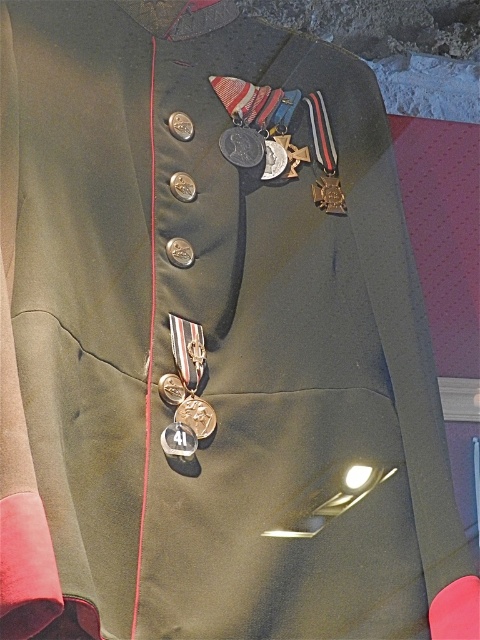
Question: In this image, where is gold metallic badge at center located relative to gold metallic cross at center?

Choices:
 (A) above
 (B) below

Answer: (B)

Question: From the image, what is the correct spatial relationship of gold metallic badge at center in relation to gold metallic cross at center?

Choices:
 (A) right
 (B) left

Answer: (B)

Question: Which object appears farthest from the camera in this image?

Choices:
 (A) gold metallic cross at center
 (B) gold metallic badge at center

Answer: (A)

Question: Does gold metallic badge at center have a lesser width compared to gold metallic cross at center?

Choices:
 (A) yes
 (B) no

Answer: (A)